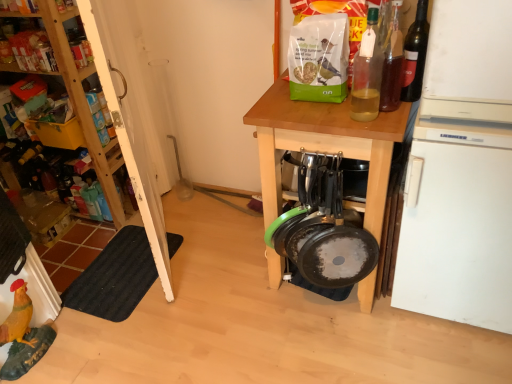
This screenshot has width=512, height=384. What are the coordinates of `free location above black rubber mat at lower left (from a real-world perspective)` in the screenshot? It's located at (101, 284).